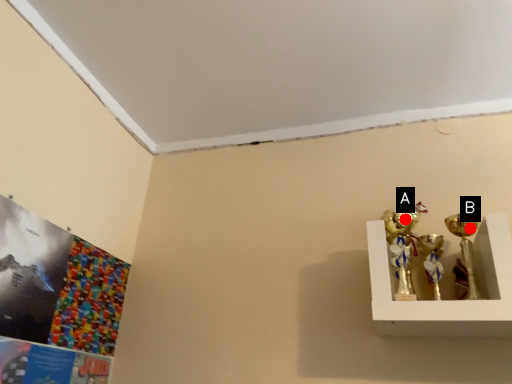
Question: Two points are circled on the image, labeled by A and B beside each circle. Which of the following is the farthest from the observer?

Choices:
 (A) A is further
 (B) B is further

Answer: (A)